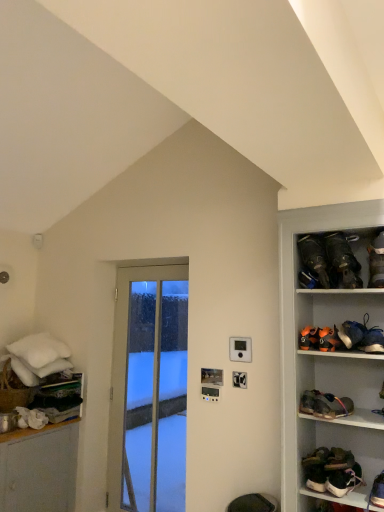
Question: From the image's perspective, is brown suede boot at right, the 9th footwear positioned from the bottom, positioned above or below green suede shoes at lower right, placed as the eighth footwear when sorted from top to bottom?

Choices:
 (A) below
 (B) above

Answer: (B)

Question: Is brown suede boot at right, the 9th footwear positioned from the bottom, to the left or to the right of green suede shoes at lower right, acting as the 3th footwear starting from the bottom, in the image?

Choices:
 (A) right
 (B) left

Answer: (A)

Question: Which object is the closest to the orange suede shoes at upper right, which ranks as the 5th footwear in top-to-bottom order?

Choices:
 (A) black leather shoes at upper right, arranged as the first footwear when viewed from the top
 (B) brown suede boot at right, the second footwear positioned from the top
 (C) matte black shoe at lower right, which appears as the 2th footwear when ordered from the bottom
 (D) orange suede shoe at upper right, positioned as the 7th footwear in bottom-to-top order
 (E) leather brown shoe at lower right, the 7th footwear in the top-to-bottom sequence

Answer: (D)

Question: Based on their relative distances, which object is nearer to the leather brown shoe at lower right, the 7th footwear in the top-to-bottom sequence?

Choices:
 (A) matte black shoe at lower right, acting as the ninth footwear starting from the top
 (B) clear glass door at center
 (C) black leather shoes at upper right, placed as the 10th footwear when sorted from bottom to top
 (D) leather brown shoe at right, the 5th footwear from the bottom
 (E) orange suede shoes at upper right, arranged as the 6th footwear when ordered from the bottom

Answer: (D)